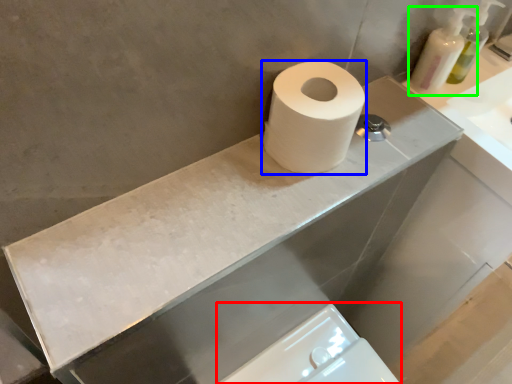
Question: Which object is the farthest from bidet (highlighted by a red box)? Choose among these: toilet paper (highlighted by a blue box) or soap dispenser (highlighted by a green box).

Choices:
 (A) toilet paper
 (B) soap dispenser

Answer: (B)